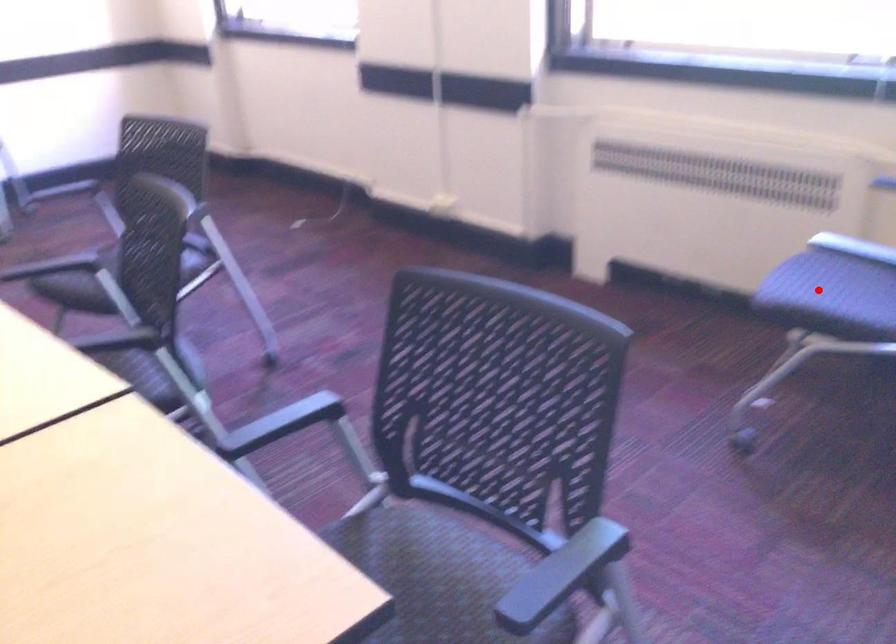
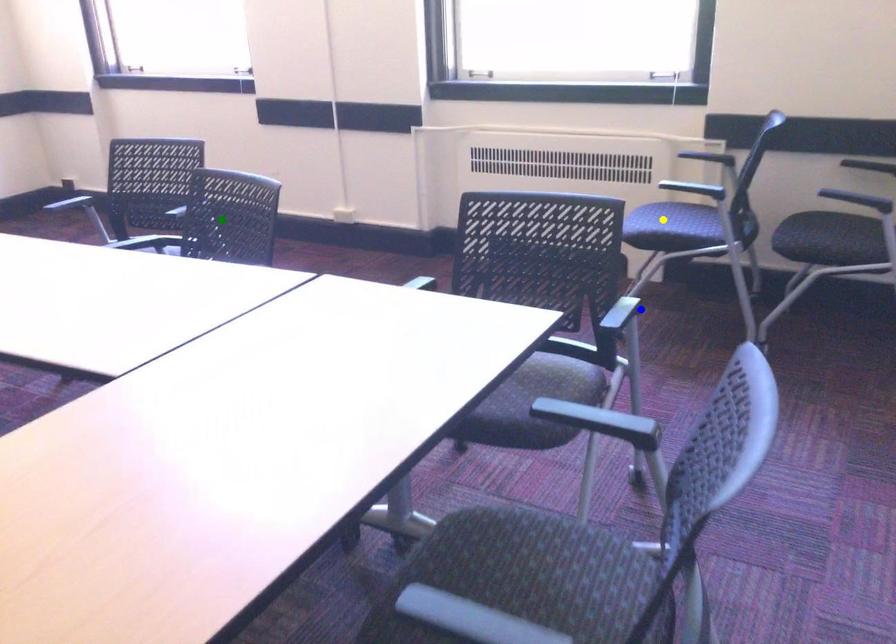
Question: I am providing you with two images of the same scene from different viewpoints. A red point is marked on the first image. You are given multiple points on the second image. In image 2, which mark is for the same physical point as the one in image 1?

Choices:
 (A) green point
 (B) yellow point
 (C) blue point

Answer: (B)